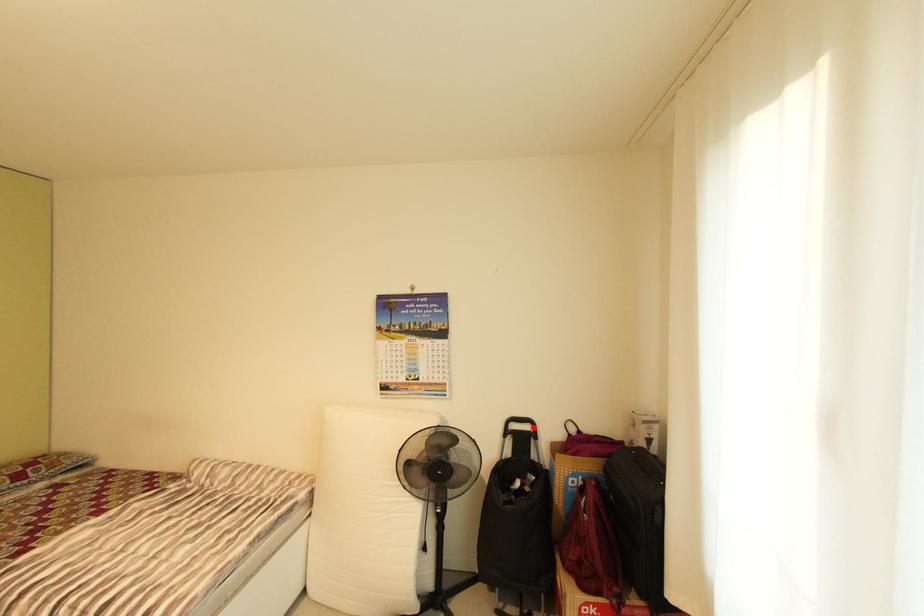
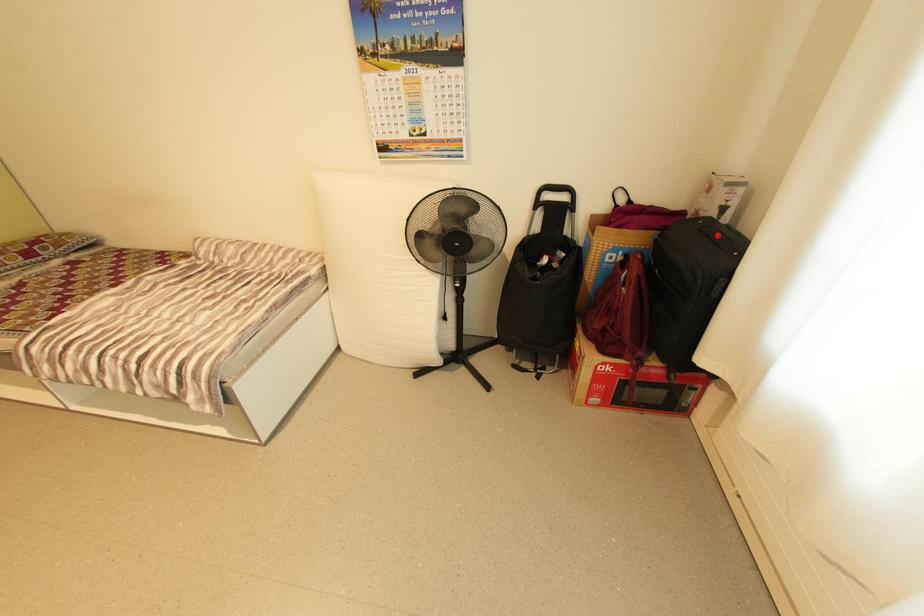
I am providing you with two images of the same scene from different viewpoints. A red point is marked on the first image and another point is marked on the second image. Is the marked point in image1 the same physical position as the marked point in image2?

No